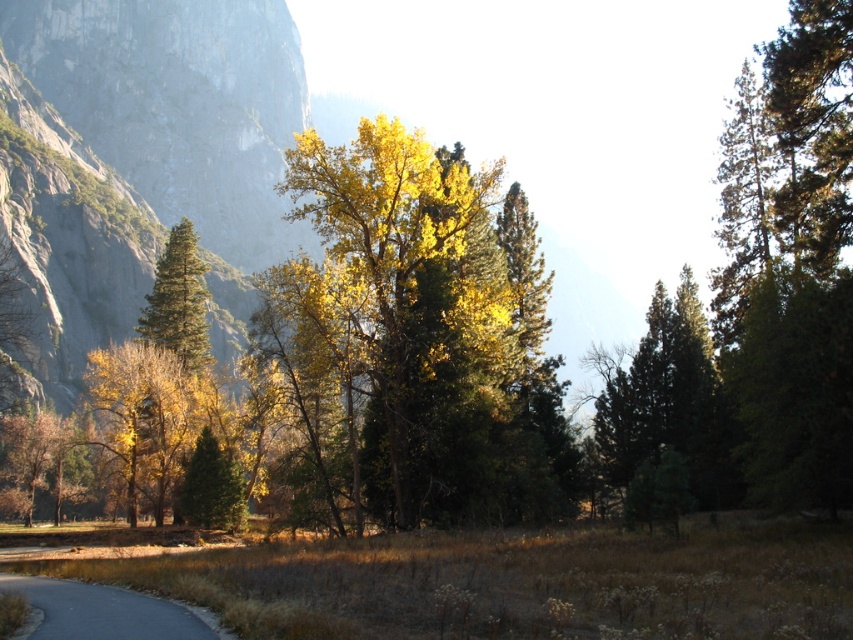
Between yellow-green foliage at center and green matte tree at center, which one has more height?

Standing taller between the two is yellow-green foliage at center.

Measure the distance between yellow-green foliage at center and camera.

yellow-green foliage at center and camera are 36.67 meters apart.

Who is more distant from viewer, (425, 428) or (222, 508)?

The point (222, 508) is behind.

This screenshot has width=853, height=640. I want to click on yellow-green foliage at center, so click(405, 332).

Does point (320, 288) come in front of point (201, 611)?

No.

Consider the image. Is yellow-green foliage at center further to camera compared to gray asphalt road at lower left?

Yes, it is.

In order to click on yellow-green foliage at center in this screenshot , I will do `click(405, 332)`.

Is gray asphalt road at lower left thinner than green matte tree at center?

No, gray asphalt road at lower left is not thinner than green matte tree at center.

Between gray asphalt road at lower left and green matte tree at center, which one appears on the right side from the viewer's perspective?

From the viewer's perspective, gray asphalt road at lower left appears more on the right side.

Identify the location of gray asphalt road at lower left. (109, 611).

Where is `gray asphalt road at lower left`? The height and width of the screenshot is (640, 853). gray asphalt road at lower left is located at coordinates (109, 611).